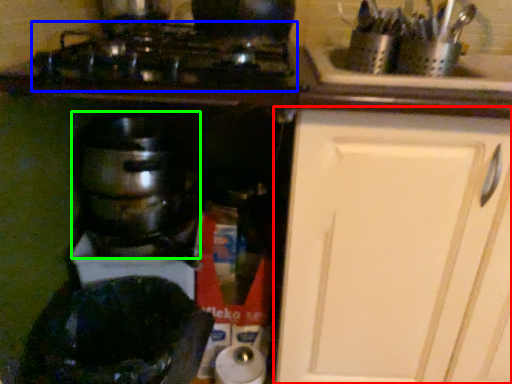
Question: Which object is positioned farthest from cabinetry (highlighted by a red box)? Select from gas stove (highlighted by a blue box) and kitchen appliance (highlighted by a green box).

Choices:
 (A) gas stove
 (B) kitchen appliance

Answer: (B)